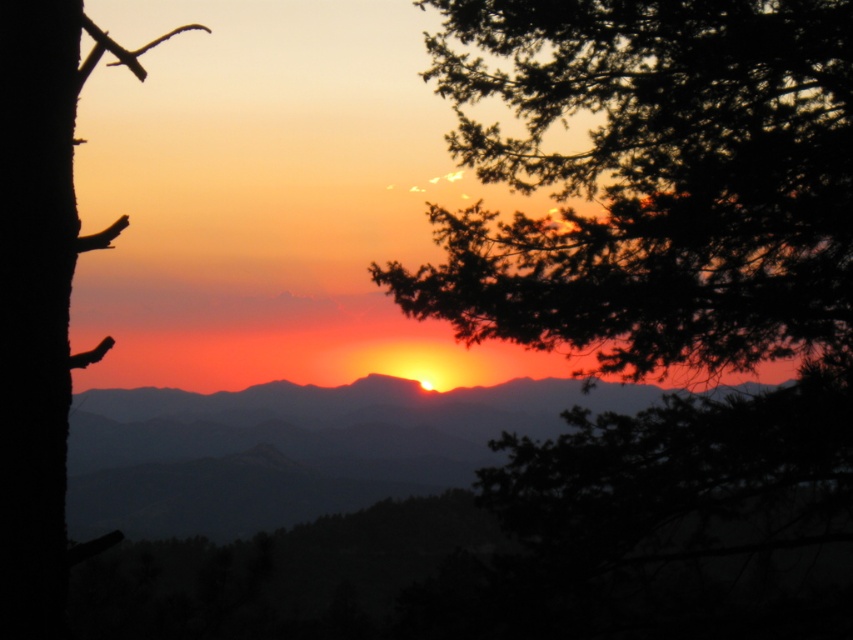
You are an artist painting this sunset scene. You want to ensure the silhouetted mountain at center and the silky brown tree trunk at left are proportionally accurate. Which object should you make wider in your painting?

The silhouetted mountain at center should be made wider than the silky brown tree trunk at left because its width surpasses the tree trunk.

You are an artist sketching this sunset scene. You want to ensure the silhouette pine branch at upper right and the silky brown tree trunk at left are proportionally accurate. Which object should you draw larger in your sketch?

The silhouette pine branch at upper right should be drawn larger than the silky brown tree trunk at left because it is described as having a larger size compared to the trunk.